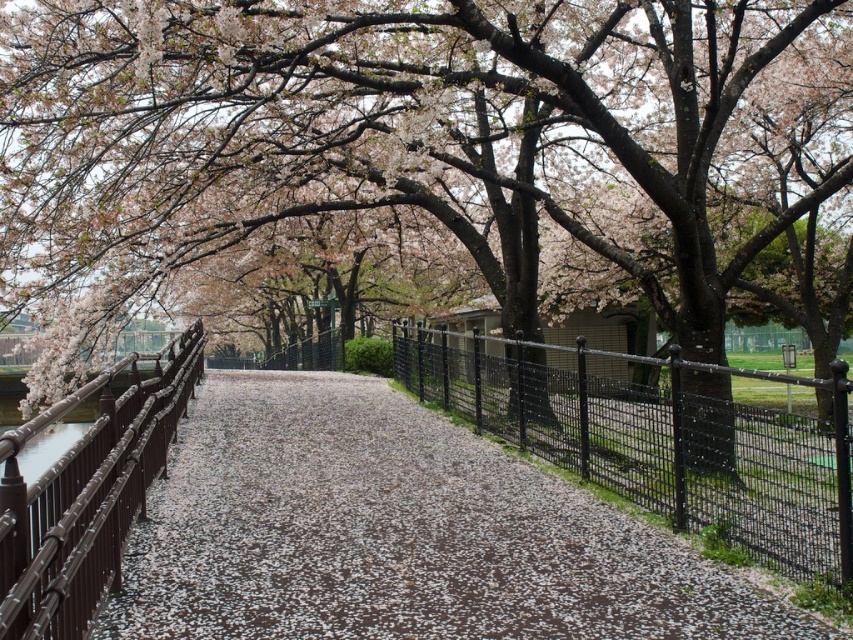
Measure the distance between black metal fence at center and brown wrought iron fence at left.

14.44 feet

Does point (724, 488) come behind point (136, 355)?

That is False.

Is point (821, 433) in front of point (131, 394)?

That is True.

Locate an element on the screen. The image size is (853, 640). black metal fence at center is located at coordinates (660, 445).

How far apart are white gravel path at center and brown wrought iron fence at left?

The distance of white gravel path at center from brown wrought iron fence at left is 1.84 meters.

Is white gravel path at center above brown wrought iron fence at left?

Actually, white gravel path at center is below brown wrought iron fence at left.

Where is `white gravel path at center`? The height and width of the screenshot is (640, 853). white gravel path at center is located at coordinates (398, 532).

At what (x,y) coordinates should I click in order to perform the action: click on white gravel path at center. Please return your answer as a coordinate pair (x, y). Looking at the image, I should click on (398, 532).

Consider the image. Does white gravel path at center appear under black metal fence at center?

Indeed, white gravel path at center is positioned under black metal fence at center.

Can you confirm if white gravel path at center is positioned to the right of black metal fence at center?

No, white gravel path at center is not to the right of black metal fence at center.

Is point (390, 561) farther from camera compared to point (741, 442)?

That is False.

The image size is (853, 640). Find the location of `white gravel path at center`. white gravel path at center is located at coordinates (398, 532).